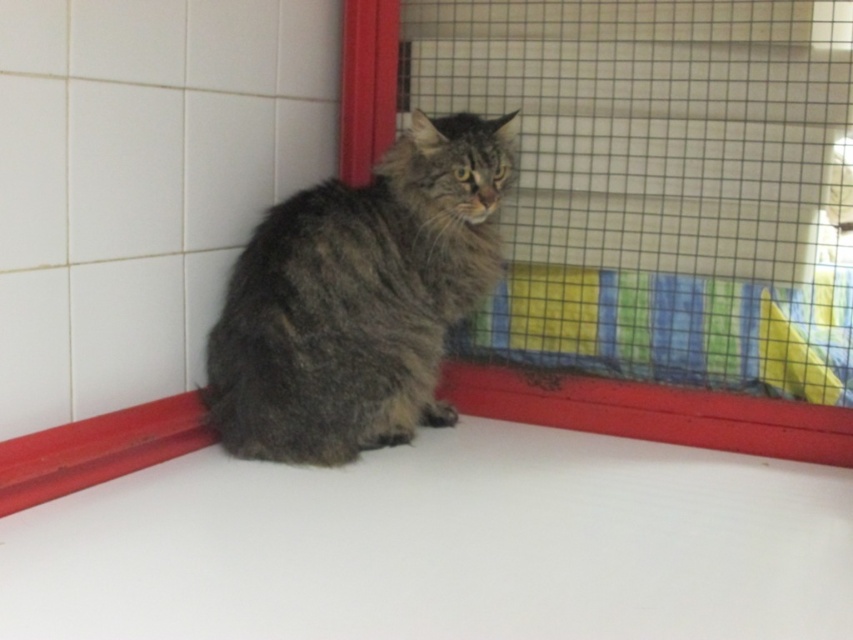
Question: Which point is closer to the camera?

Choices:
 (A) soft mesh cage at center
 (B) gray fluffy cat at center

Answer: (B)

Question: Is gray fluffy cat at center further to camera compared to soft mesh cage at center?

Choices:
 (A) no
 (B) yes

Answer: (A)

Question: Is gray fluffy cat at center to the left of soft mesh cage at center from the viewer's perspective?

Choices:
 (A) yes
 (B) no

Answer: (A)

Question: Can you confirm if gray fluffy cat at center is positioned to the left of soft mesh cage at center?

Choices:
 (A) no
 (B) yes

Answer: (B)